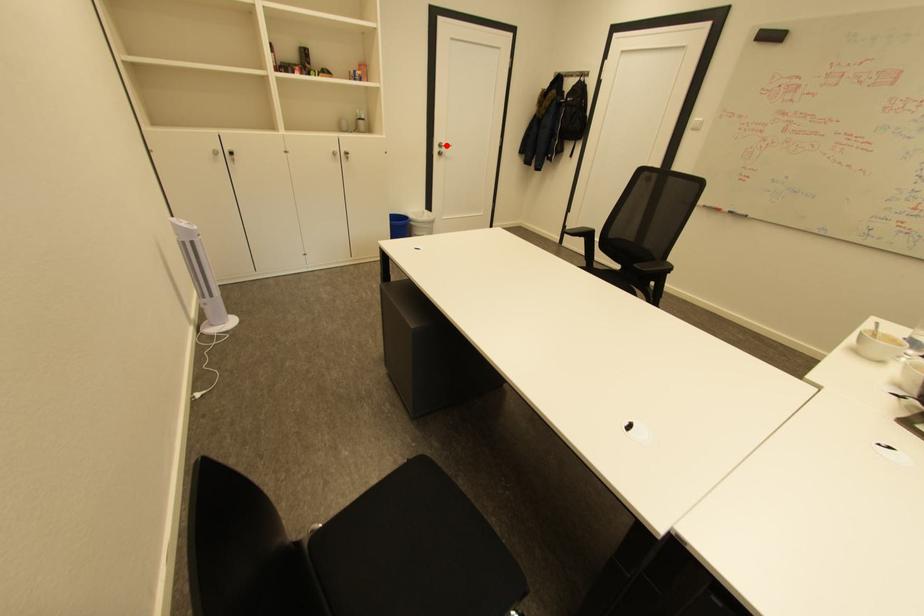
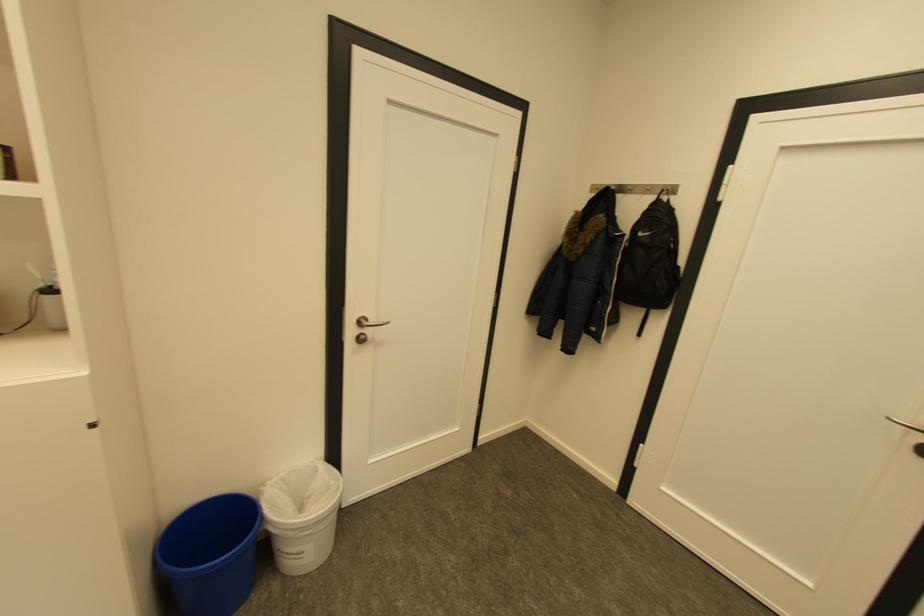
Locate, in the second image, the point that corresponds to the highlighted location in the first image.

(367, 323)